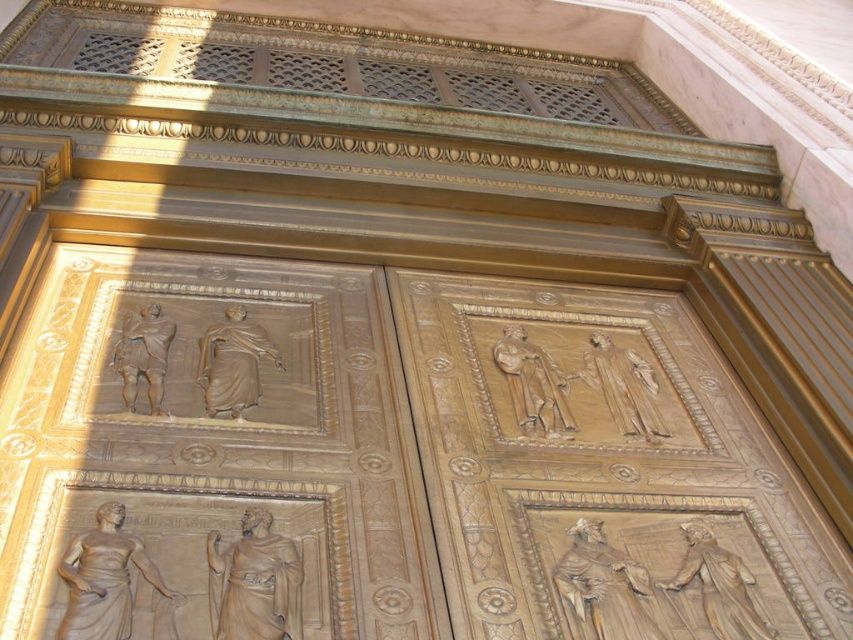
Is point (204, 336) closer to viewer compared to point (527, 433)?

No, (204, 336) is behind (527, 433).

The image size is (853, 640). What are the coordinates of `matte bronze statue at center` in the screenshot? It's located at (233, 364).

Which is below, polished bronze relief at lower right or matte bronze statue at center?

polished bronze relief at lower right is lower down.

Who is shorter, polished bronze relief at lower right or matte bronze statue at center?

With less height is polished bronze relief at lower right.

Does point (717, 576) lie in front of point (231, 401)?

Yes, point (717, 576) is closer to viewer.

Where is `polished bronze relief at lower right`? This screenshot has width=853, height=640. polished bronze relief at lower right is located at coordinates (718, 586).

Which is in front, point (228, 346) or point (132, 381)?

Point (132, 381)

Can you confirm if matte bronze statue at center is smaller than golden bronze relief at upper left?

Incorrect, matte bronze statue at center is not smaller in size than golden bronze relief at upper left.

Locate an element on the screen. The image size is (853, 640). matte bronze statue at center is located at coordinates (233, 364).